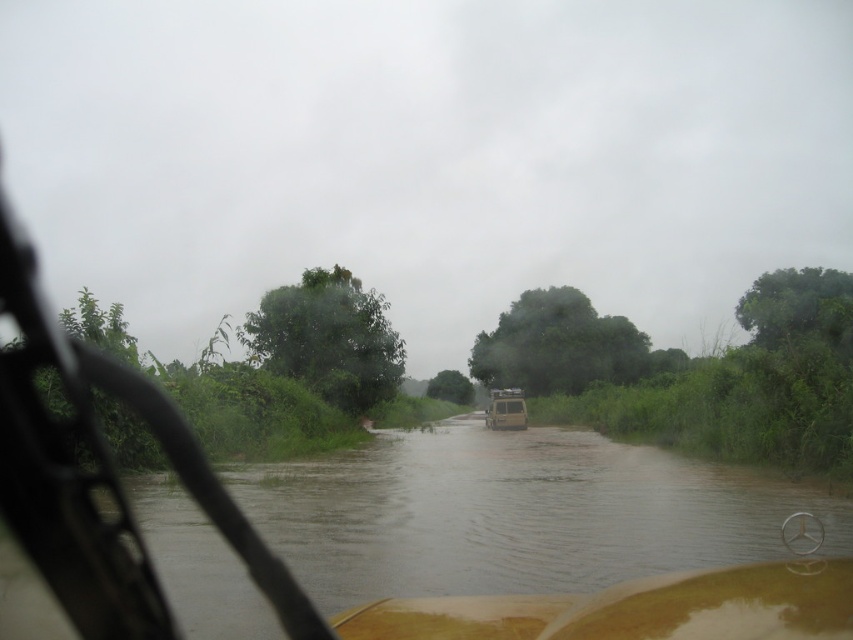
Does brown muddy river at center appear under metallic silver jeep at center?

Incorrect, brown muddy river at center is not positioned below metallic silver jeep at center.

Can you confirm if brown muddy river at center is smaller than metallic silver jeep at center?

No.

The image size is (853, 640). Identify the location of brown muddy river at center. (512, 515).